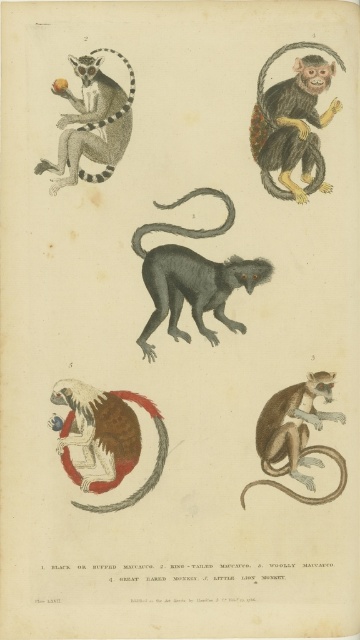
You are observing two points in a scientific illustration. The first point is at coordinates point (110, 424) and the second is at point (205, 232). Which of these points is nearer to the viewer?

Point (110, 424) is closer to the camera than point (205, 232).

You are an animal caretaker observing the image of primates. You need to determine which object is higher in height between the brown fur monkey at center and the black matte tail at center. Which one is taller?

The brown fur monkey at center is taller than the black matte tail at center according to the description.